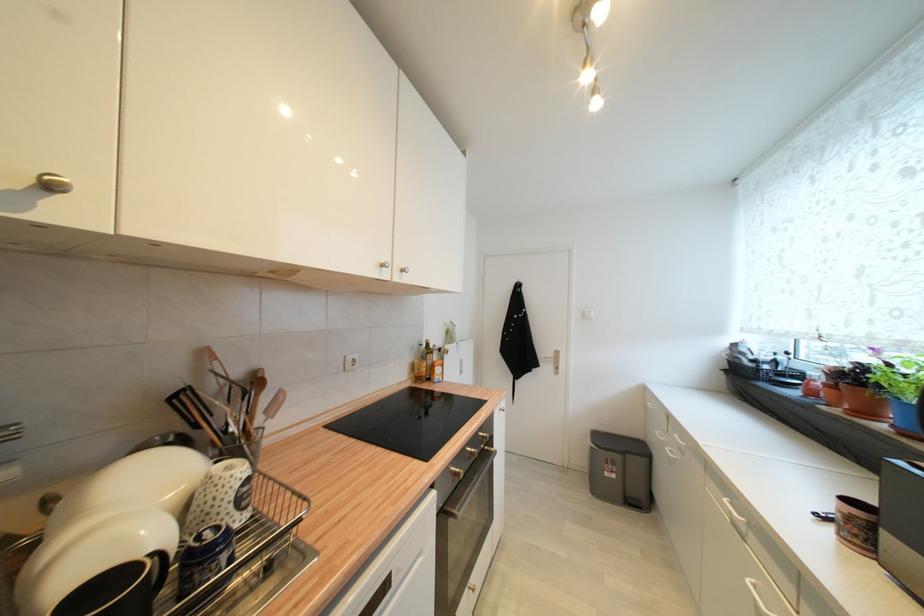
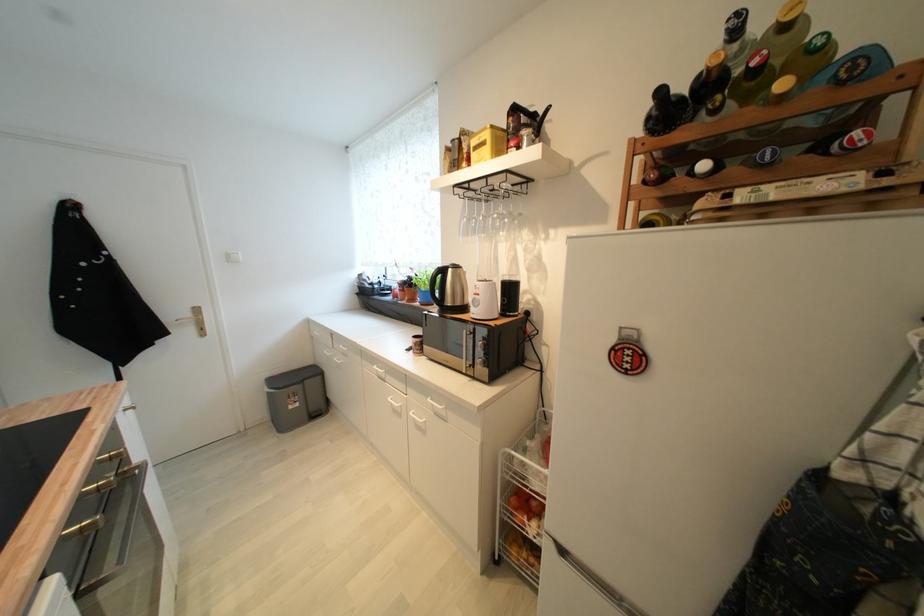
Locate, in the second image, the point that corresponds to point 555,369 in the first image.

(197, 331)